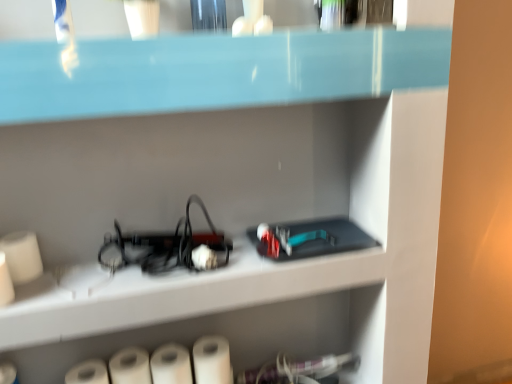
What is the approximate height of white matte paper towel at lower left, the 3th paper towel when ordered from right to left?

The height of white matte paper towel at lower left, the 3th paper towel when ordered from right to left, is 9.91 centimeters.

This screenshot has width=512, height=384. Describe the element at coordinates (212, 360) in the screenshot. I see `white matte paper towel at lower center, marked as the 4th paper towel in a left-to-right arrangement` at that location.

The width and height of the screenshot is (512, 384). Find the location of `white matte paper towel at lower left, the fourth paper towel positioned from the right`. white matte paper towel at lower left, the fourth paper towel positioned from the right is located at coordinates (88, 373).

Considering the sizes of objects white matte paper towel at lower center, which is the 1th paper towel in right-to-left order, and white matte paper towel at lower center, the 2th paper towel positioned from the right, in the image provided, who is taller, white matte paper towel at lower center, which is the 1th paper towel in right-to-left order, or white matte paper towel at lower center, the 2th paper towel positioned from the right,?

Standing taller between the two is white matte paper towel at lower center, which is the 1th paper towel in right-to-left order.

Is white matte paper towel at lower center, which is the 1th paper towel in right-to-left order, in front of or behind white matte paper towel at lower center, acting as the 3th paper towel starting from the left, in the image?

In the image, white matte paper towel at lower center, which is the 1th paper towel in right-to-left order, appears behind white matte paper towel at lower center, acting as the 3th paper towel starting from the left.

Is white matte paper towel at lower center, which is the 1th paper towel in right-to-left order, wider or thinner than white matte paper towel at lower center, acting as the 3th paper towel starting from the left?

Clearly, white matte paper towel at lower center, which is the 1th paper towel in right-to-left order, has less width compared to white matte paper towel at lower center, acting as the 3th paper towel starting from the left.

I want to click on paper towel that is above the white matte paper towel at lower center, the 2th paper towel positioned from the right (from the image's perspective), so click(x=212, y=360).

Between white matte paper towel at lower center, the 2th paper towel positioned from the right, and white matte paper towel at lower left, arranged as the second paper towel when viewed from the left, which one has larger size?

white matte paper towel at lower center, the 2th paper towel positioned from the right.

Consider the image. Which object is positioned more to the left, white matte paper towel at lower center, the 2th paper towel positioned from the right, or white matte paper towel at lower left, arranged as the second paper towel when viewed from the left?

Positioned to the left is white matte paper towel at lower left, arranged as the second paper towel when viewed from the left.

Is white matte paper towel at lower center, acting as the 3th paper towel starting from the left, located outside white matte paper towel at lower left, the 3th paper towel when ordered from right to left?

Yes, white matte paper towel at lower center, acting as the 3th paper towel starting from the left, is outside of white matte paper towel at lower left, the 3th paper towel when ordered from right to left.

Is point (166, 364) positioned behind point (109, 371)?

Yes, it is behind point (109, 371).

Is the depth of white matte paper towel at lower left, the 3th paper towel when ordered from right to left, less than that of white matte paper towel at lower left, the fourth paper towel positioned from the right?

No, white matte paper towel at lower left, the 3th paper towel when ordered from right to left, is behind white matte paper towel at lower left, the fourth paper towel positioned from the right.

From the image's perspective, relative to white matte paper towel at lower left, which is the 1th paper towel in left-to-right order, is white matte paper towel at lower left, the 3th paper towel when ordered from right to left, above or below?

white matte paper towel at lower left, the 3th paper towel when ordered from right to left, is above white matte paper towel at lower left, which is the 1th paper towel in left-to-right order.

Which object is thinner, white matte paper towel at lower left, the 3th paper towel when ordered from right to left, or white matte paper towel at lower left, which is the 1th paper towel in left-to-right order?

With smaller width is white matte paper towel at lower left, the 3th paper towel when ordered from right to left.

Could you tell me if white matte paper towel at lower left, arranged as the second paper towel when viewed from the left, is facing white matte paper towel at lower left, the fourth paper towel positioned from the right?

No, white matte paper towel at lower left, arranged as the second paper towel when viewed from the left, is not oriented towards white matte paper towel at lower left, the fourth paper towel positioned from the right.

You are a GUI agent. You are given a task and a screenshot of the screen. Output one action in this format:
    pyautogui.click(x=<x>, y=<y>)
    Task: Click on the 3rd paper towel above when counting from the white matte paper towel at lower left, which is the 1th paper towel in left-to-right order (from the image's perspective)
    The width and height of the screenshot is (512, 384).
    Given the screenshot: What is the action you would take?
    pyautogui.click(x=212, y=360)

Can you confirm if white matte paper towel at lower left, the fourth paper towel positioned from the right, is thinner than white matte paper towel at lower center, marked as the 4th paper towel in a left-to-right arrangement?

In fact, white matte paper towel at lower left, the fourth paper towel positioned from the right, might be wider than white matte paper towel at lower center, marked as the 4th paper towel in a left-to-right arrangement.

From the image's perspective, relative to white matte paper towel at lower center, which is the 1th paper towel in right-to-left order, is white matte paper towel at lower left, the fourth paper towel positioned from the right, above or below?

From the image's perspective, white matte paper towel at lower left, the fourth paper towel positioned from the right, appears below white matte paper towel at lower center, which is the 1th paper towel in right-to-left order.

Which object is positioned more to the left, white matte paper towel at lower left, which is the 1th paper towel in left-to-right order, or white matte paper towel at lower center, marked as the 4th paper towel in a left-to-right arrangement?

white matte paper towel at lower left, which is the 1th paper towel in left-to-right order.

Is white matte paper towel at lower left, the fourth paper towel positioned from the right, facing towards white matte paper towel at lower left, arranged as the second paper towel when viewed from the left?

No, white matte paper towel at lower left, the fourth paper towel positioned from the right, is not facing towards white matte paper towel at lower left, arranged as the second paper towel when viewed from the left.

Which is behind, point (78, 376) or point (143, 378)?

Positioned behind is point (143, 378).

Measure the distance from white matte paper towel at lower left, the fourth paper towel positioned from the right, to white matte paper towel at lower left, arranged as the second paper towel when viewed from the left.

2.28 inches.

Considering the sizes of objects white matte paper towel at lower left, arranged as the second paper towel when viewed from the left, and white matte paper towel at lower center, the 2th paper towel positioned from the right, in the image provided, who is smaller, white matte paper towel at lower left, arranged as the second paper towel when viewed from the left, or white matte paper towel at lower center, the 2th paper towel positioned from the right,?

white matte paper towel at lower left, arranged as the second paper towel when viewed from the left, is smaller.

Is white matte paper towel at lower left, the 3th paper towel when ordered from right to left, turned away from white matte paper towel at lower center, the 2th paper towel positioned from the right?

No, white matte paper towel at lower center, the 2th paper towel positioned from the right, is not at the back of white matte paper towel at lower left, the 3th paper towel when ordered from right to left.

Does point (111, 367) lie in front of point (156, 352)?

Yes, point (111, 367) is closer to viewer.

Consider the image. Is white matte paper towel at lower left, the 3th paper towel when ordered from right to left, aimed at white matte paper towel at lower center, which is the 1th paper towel in right-to-left order?

No.

Which is behind, white matte paper towel at lower left, the 3th paper towel when ordered from right to left, or white matte paper towel at lower center, marked as the 4th paper towel in a left-to-right arrangement?

Positioned behind is white matte paper towel at lower center, marked as the 4th paper towel in a left-to-right arrangement.

Is point (132, 380) closer or farther from the camera than point (220, 351)?

Clearly, point (132, 380) is closer to the camera than point (220, 351).

What's the angular difference between white matte paper towel at lower left, arranged as the second paper towel when viewed from the left, and white matte paper towel at lower center, which is the 1th paper towel in right-to-left order,'s facing directions?

They differ by 0.000526 degrees in their facing directions.

Image resolution: width=512 pixels, height=384 pixels. Identify the location of paper towel that is the 1st one below the white matte paper towel at lower center, marked as the 4th paper towel in a left-to-right arrangement (from a real-world perspective). (170, 365).

The height and width of the screenshot is (384, 512). Identify the location of paper towel that is the 1st object to the right of the white matte paper towel at lower left, arranged as the second paper towel when viewed from the left, starting at the anchor. (170, 365).

Estimate the real-world distances between objects in this image. Which object is closer to white matte paper towel at lower center, marked as the 4th paper towel in a left-to-right arrangement, white matte paper towel at lower center, the 2th paper towel positioned from the right, or white matte paper towel at lower left, the 3th paper towel when ordered from right to left?

The object closer to white matte paper towel at lower center, marked as the 4th paper towel in a left-to-right arrangement, is white matte paper towel at lower center, the 2th paper towel positioned from the right.

From the image, which object appears to be farther from white matte paper towel at lower left, which is the 1th paper towel in left-to-right order, white matte paper towel at lower left, the 3th paper towel when ordered from right to left, or white matte paper towel at lower center, marked as the 4th paper towel in a left-to-right arrangement?

white matte paper towel at lower center, marked as the 4th paper towel in a left-to-right arrangement, is further to white matte paper towel at lower left, which is the 1th paper towel in left-to-right order.

Which object lies nearer to the anchor point white matte paper towel at lower center, acting as the 3th paper towel starting from the left, white matte paper towel at lower center, which is the 1th paper towel in right-to-left order, or white matte paper towel at lower left, the 3th paper towel when ordered from right to left?

The object closer to white matte paper towel at lower center, acting as the 3th paper towel starting from the left, is white matte paper towel at lower left, the 3th paper towel when ordered from right to left.

Looking at the image, which one is located closer to white matte paper towel at lower left, the fourth paper towel positioned from the right, white matte paper towel at lower center, the 2th paper towel positioned from the right, or white matte paper towel at lower center, which is the 1th paper towel in right-to-left order?

white matte paper towel at lower center, the 2th paper towel positioned from the right.

Based on their spatial positions, is white matte paper towel at lower left, which is the 1th paper towel in left-to-right order, or white matte paper towel at lower center, which is the 1th paper towel in right-to-left order, closer to white matte paper towel at lower left, the 3th paper towel when ordered from right to left?

white matte paper towel at lower left, which is the 1th paper towel in left-to-right order.

When comparing their distances from white matte paper towel at lower left, which is the 1th paper towel in left-to-right order, does white matte paper towel at lower center, which is the 1th paper towel in right-to-left order, or white matte paper towel at lower center, acting as the 3th paper towel starting from the left, seem closer?

white matte paper towel at lower center, acting as the 3th paper towel starting from the left, is closer to white matte paper towel at lower left, which is the 1th paper towel in left-to-right order.

When comparing their distances from white matte paper towel at lower center, the 2th paper towel positioned from the right, does white matte paper towel at lower center, marked as the 4th paper towel in a left-to-right arrangement, or white matte paper towel at lower left, the fourth paper towel positioned from the right, seem closer?

white matte paper towel at lower center, marked as the 4th paper towel in a left-to-right arrangement, is positioned closer to the anchor white matte paper towel at lower center, the 2th paper towel positioned from the right.

Estimate the real-world distances between objects in this image. Which object is further from white matte paper towel at lower center, which is the 1th paper towel in right-to-left order, white matte paper towel at lower left, the 3th paper towel when ordered from right to left, or white matte paper towel at lower left, the fourth paper towel positioned from the right?

white matte paper towel at lower left, the fourth paper towel positioned from the right, is further to white matte paper towel at lower center, which is the 1th paper towel in right-to-left order.

Locate an element on the screen. Image resolution: width=512 pixels, height=384 pixels. paper towel between white matte paper towel at lower left, the fourth paper towel positioned from the right, and white matte paper towel at lower center, acting as the 3th paper towel starting from the left, in the horizontal direction is located at coordinates [x=130, y=366].

Locate an element on the screen. paper towel situated between white matte paper towel at lower left, the 3th paper towel when ordered from right to left, and white matte paper towel at lower center, marked as the 4th paper towel in a left-to-right arrangement, from left to right is located at coordinates (170, 365).